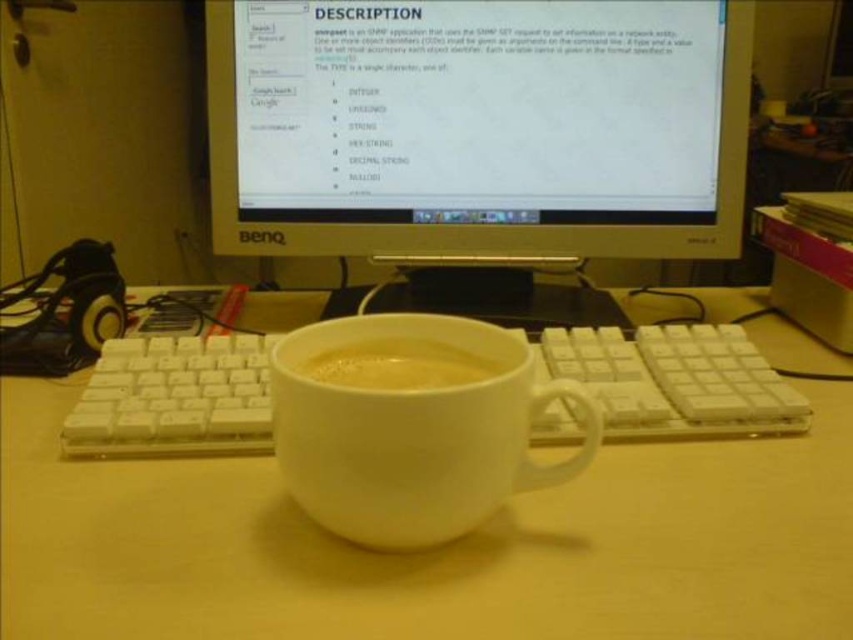
Is point (439, 51) positioned before point (395, 348)?

No, (439, 51) is behind (395, 348).

Who is more distant from viewer, (502, 20) or (412, 378)?

The point (502, 20) is more distant.

Identify the location of white glossy computer monitor at upper center. (479, 125).

Does white plastic keyboard at center come in front of white glossy computer monitor at upper center?

Yes.

Is white plastic keyboard at center below white glossy computer monitor at upper center?

Correct, white plastic keyboard at center is located below white glossy computer monitor at upper center.

Measure the distance between point (158, 628) and camera.

The distance of point (158, 628) from camera is 13.49 inches.

The height and width of the screenshot is (640, 853). What are the coordinates of `white plastic keyboard at center` in the screenshot? It's located at click(430, 550).

Is white matte mug at center taller than white matte cup at center?

Correct, white matte mug at center is much taller as white matte cup at center.

Image resolution: width=853 pixels, height=640 pixels. I want to click on white matte mug at center, so click(x=413, y=429).

Who is more distant from viewer, (415, 333) or (448, 378)?

The point (415, 333) is behind.

Locate an element on the screen. white matte mug at center is located at coordinates (413, 429).